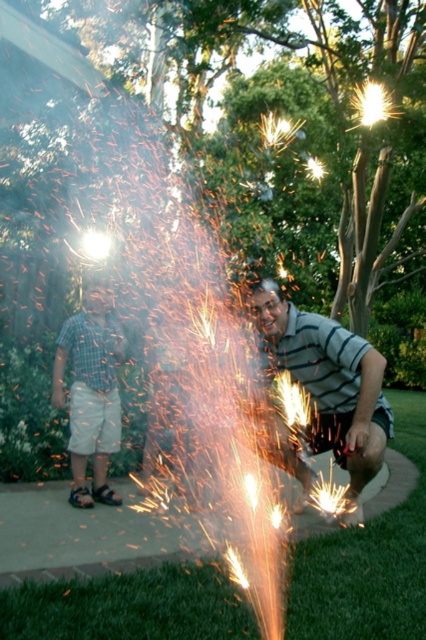
Question: Can you confirm if matte striped shirt at right is wider than checkered fabric shirt at left?

Choices:
 (A) no
 (B) yes

Answer: (B)

Question: Is matte striped shirt at right bigger than checkered fabric shirt at left?

Choices:
 (A) no
 (B) yes

Answer: (B)

Question: Which of the following is the farthest from the observer?

Choices:
 (A) (362, 371)
 (B) (112, 408)

Answer: (B)

Question: Can you confirm if matte striped shirt at right is bigger than checkered fabric shirt at left?

Choices:
 (A) yes
 (B) no

Answer: (A)